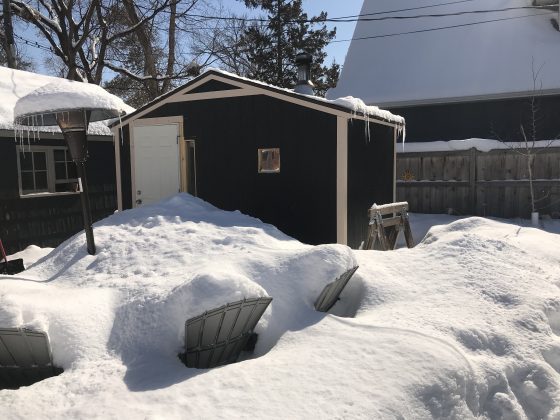
This screenshot has width=560, height=420. I want to click on 1 light, so click(77, 114).